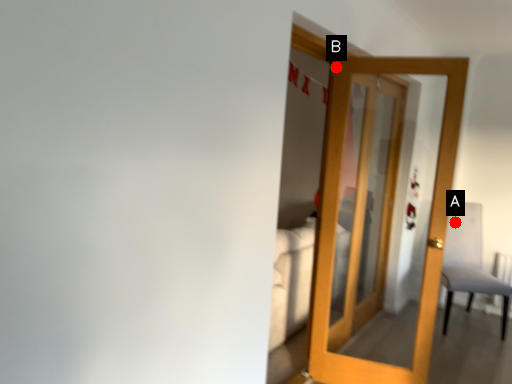
Question: Two points are circled on the image, labeled by A and B beside each circle. Which point is closer to the camera taking this photo?

Choices:
 (A) A is closer
 (B) B is closer

Answer: (B)